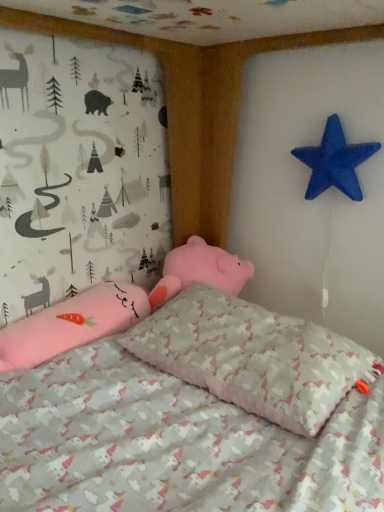
The height and width of the screenshot is (512, 384). What do you see at coordinates (335, 161) in the screenshot? I see `blue matte star at upper right` at bounding box center [335, 161].

Find the location of `blue matte star at upper right`. blue matte star at upper right is located at coordinates (335, 161).

Measure the distance between point [362,154] and camera.

Point [362,154] is 1.23 meters away from camera.

What is the approximate height of blue matte star at upper right?

The height of blue matte star at upper right is 8.21 inches.

Measure the distance between blue matte star at upper right and camera.

3.98 feet.

Describe the element at coordinates (253, 356) in the screenshot. I see `unicorn-patterned fabric pillow at center` at that location.

Locate an element on the screen. Image resolution: width=384 pixels, height=512 pixels. unicorn-patterned fabric pillow at center is located at coordinates (253, 356).

Where is `blue matte star at upper right`? The image size is (384, 512). blue matte star at upper right is located at coordinates (335, 161).

Is blue matte star at upper right at the left side of unicorn-patterned fabric pillow at center?

No.

Between blue matte star at upper right and unicorn-patterned fabric pillow at center, which one is positioned behind?

blue matte star at upper right is behind.

Considering the points (332, 141) and (292, 339), which point is behind, point (332, 141) or point (292, 339)?

Positioned behind is point (332, 141).

From the image's perspective, is blue matte star at upper right beneath unicorn-patterned fabric pillow at center?

No, from the image's perspective, blue matte star at upper right is not below unicorn-patterned fabric pillow at center.

From a real-world perspective, is blue matte star at upper right on top of unicorn-patterned fabric pillow at center?

Yes, from a real-world perspective, blue matte star at upper right is over unicorn-patterned fabric pillow at center

Can you confirm if blue matte star at upper right is wider than unicorn-patterned fabric pillow at center?

No.

Considering the sizes of blue matte star at upper right and unicorn-patterned fabric pillow at center in the image, is blue matte star at upper right taller or shorter than unicorn-patterned fabric pillow at center?

blue matte star at upper right is taller than unicorn-patterned fabric pillow at center.

Considering the sizes of blue matte star at upper right and unicorn-patterned fabric pillow at center in the image, is blue matte star at upper right bigger or smaller than unicorn-patterned fabric pillow at center?

blue matte star at upper right is smaller than unicorn-patterned fabric pillow at center.

Is unicorn-patterned fabric pillow at center inside blue matte star at upper right?

No, unicorn-patterned fabric pillow at center is located outside of blue matte star at upper right.

Is blue matte star at upper right far from unicorn-patterned fabric pillow at center?

No.

Is blue matte star at upper right turned away from unicorn-patterned fabric pillow at center?

No, unicorn-patterned fabric pillow at center is not at the back of blue matte star at upper right.

The image size is (384, 512). I want to click on starfish above the unicorn-patterned fabric pillow at center (from a real-world perspective), so click(x=335, y=161).

Is unicorn-patterned fabric pillow at center to the left of blue matte star at upper right from the viewer's perspective?

Yes.

Which object is closer to the camera, unicorn-patterned fabric pillow at center or blue matte star at upper right?

unicorn-patterned fabric pillow at center is in front.

Looking at this image, which point is more forward, (x=245, y=375) or (x=319, y=187)?

The point (x=245, y=375) is closer.

From the image's perspective, is unicorn-patterned fabric pillow at center beneath blue matte star at upper right?

Yes.

From a real-world perspective, is unicorn-patterned fabric pillow at center below blue matte star at upper right?

Yes, from a real-world perspective, unicorn-patterned fabric pillow at center is under blue matte star at upper right.

Between unicorn-patterned fabric pillow at center and blue matte star at upper right, which one has larger width?

unicorn-patterned fabric pillow at center.

Can you confirm if unicorn-patterned fabric pillow at center is taller than blue matte star at upper right?

No.

Looking at the image, does unicorn-patterned fabric pillow at center seem bigger or smaller compared to blue matte star at upper right?

unicorn-patterned fabric pillow at center is bigger than blue matte star at upper right.

Which is correct: unicorn-patterned fabric pillow at center is inside blue matte star at upper right, or outside of it?

unicorn-patterned fabric pillow at center lies outside blue matte star at upper right.

Is there a large distance between unicorn-patterned fabric pillow at center and blue matte star at upper right?

No, unicorn-patterned fabric pillow at center is in close proximity to blue matte star at upper right.

Is unicorn-patterned fabric pillow at center facing towards blue matte star at upper right?

No, unicorn-patterned fabric pillow at center is not aimed at blue matte star at upper right.

Can you tell me how much unicorn-patterned fabric pillow at center and blue matte star at upper right differ in facing direction?

The angle between the facing direction of unicorn-patterned fabric pillow at center and the facing direction of blue matte star at upper right is 0.65 degrees.

The width and height of the screenshot is (384, 512). I want to click on pillow below the blue matte star at upper right (from a real-world perspective), so click(253, 356).

Find the location of `starfish lying above the unicorn-patterned fabric pillow at center (from the image's perspective)`. starfish lying above the unicorn-patterned fabric pillow at center (from the image's perspective) is located at coordinates (335, 161).

This screenshot has height=512, width=384. In order to click on starfish that is above the unicorn-patterned fabric pillow at center (from a real-world perspective) in this screenshot , I will do `click(335, 161)`.